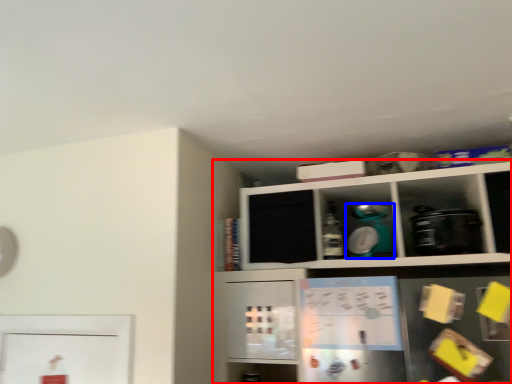
Question: Which object appears farthest to the camera in this image, shelf (highlighted by a red box) or appliance (highlighted by a blue box)?

Choices:
 (A) shelf
 (B) appliance

Answer: (B)